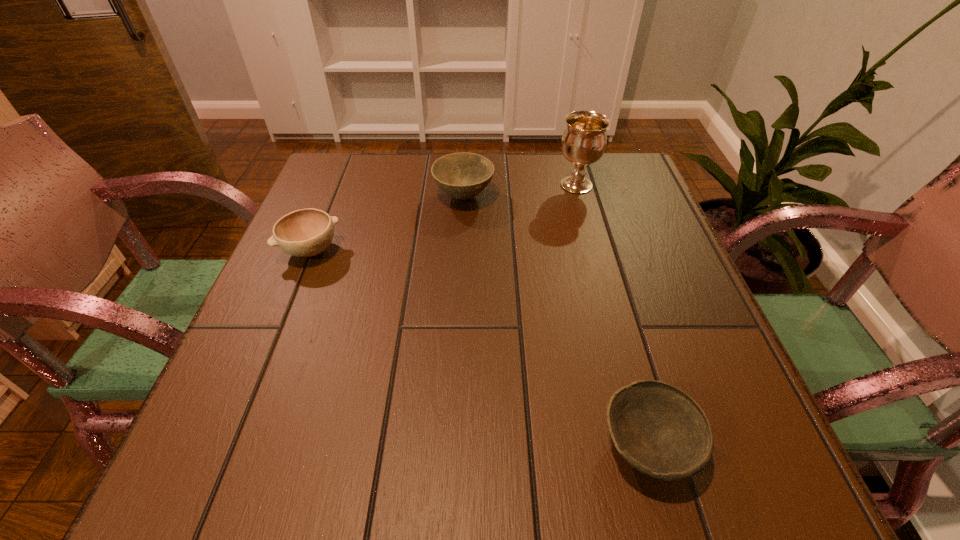
Locate an element on the screen. This screenshot has height=540, width=960. free area in between the farthest bowl and the nearest object is located at coordinates click(x=556, y=321).

Locate an element on the screen. Image resolution: width=960 pixels, height=540 pixels. empty location between the tallest object and the farthest bowl is located at coordinates (520, 191).

Find the location of a particular element. unoccupied position between the second bowl from right to left and the third farthest object is located at coordinates (387, 224).

At what (x,y) coordinates should I click in order to perform the action: click on empty space between the second nearest object and the chalice. Please return your answer as a coordinate pair (x, y). The width and height of the screenshot is (960, 540). Looking at the image, I should click on (444, 218).

This screenshot has height=540, width=960. In order to click on free space between the leftmost bowl and the farthest bowl in this screenshot , I will do `click(387, 224)`.

At what (x,y) coordinates should I click in order to perform the action: click on object that is the closest to the farthest bowl. Please return your answer as a coordinate pair (x, y). Image resolution: width=960 pixels, height=540 pixels. Looking at the image, I should click on (584, 140).

Find the location of a particular element. This screenshot has width=960, height=540. object that is the third closest one to the leftmost object is located at coordinates (661, 431).

Identify the location of the second closest bowl to the tallest object. Image resolution: width=960 pixels, height=540 pixels. (308, 232).

Locate an element on the screen. This screenshot has width=960, height=540. bowl object that ranks as the closest to the nearest object is located at coordinates (462, 176).

The image size is (960, 540). I want to click on free space that satisfies the following two spatial constraints: 1. on the back side of the third object from right to left; 2. on the left side of the second farthest bowl, so click(x=333, y=197).